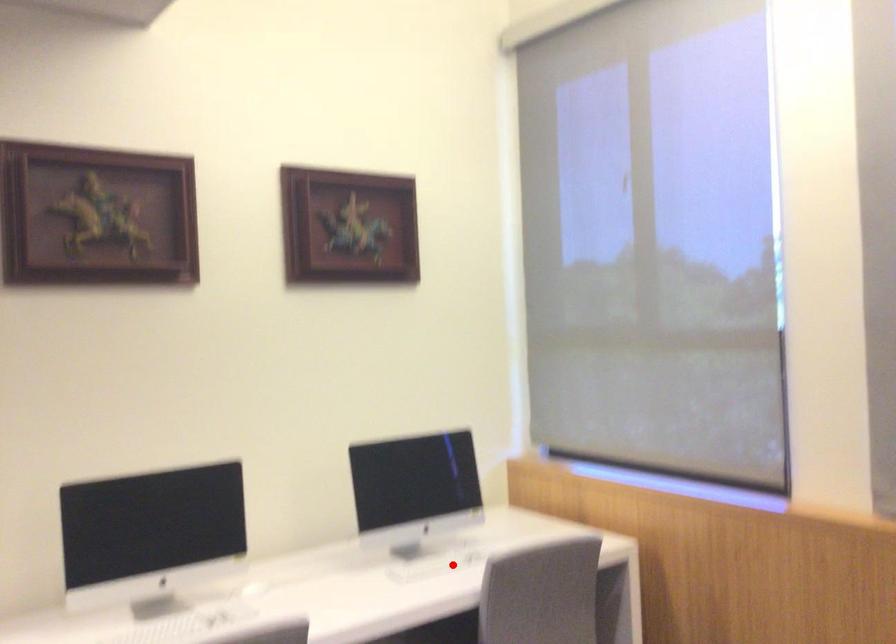
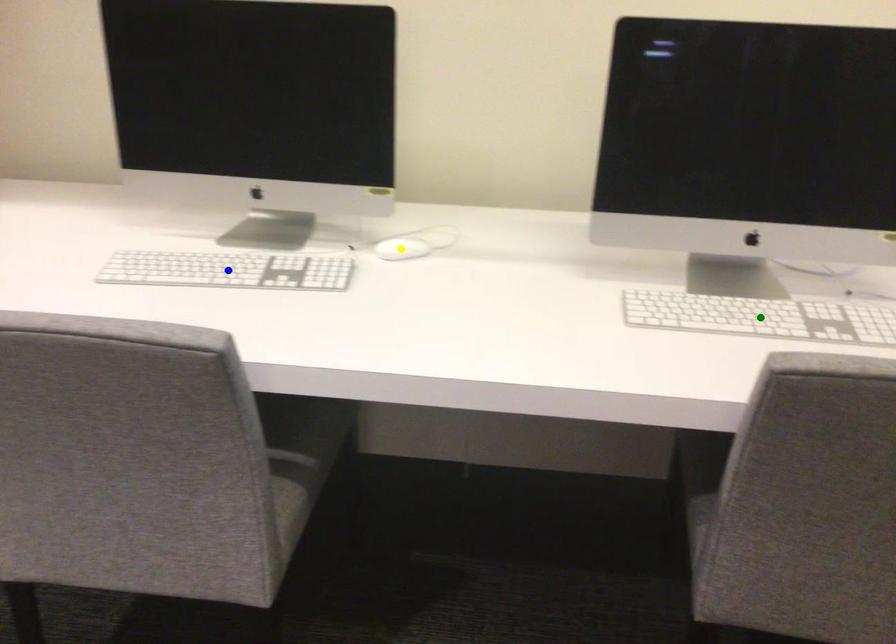
Question: I am providing you with two images of the same scene from different viewpoints. A red point is marked on the first image. You are given multiple points on the second image. Which point in image 2 is actually the same real-world point as the red point in image 1?

Choices:
 (A) yellow point
 (B) blue point
 (C) green point

Answer: (C)